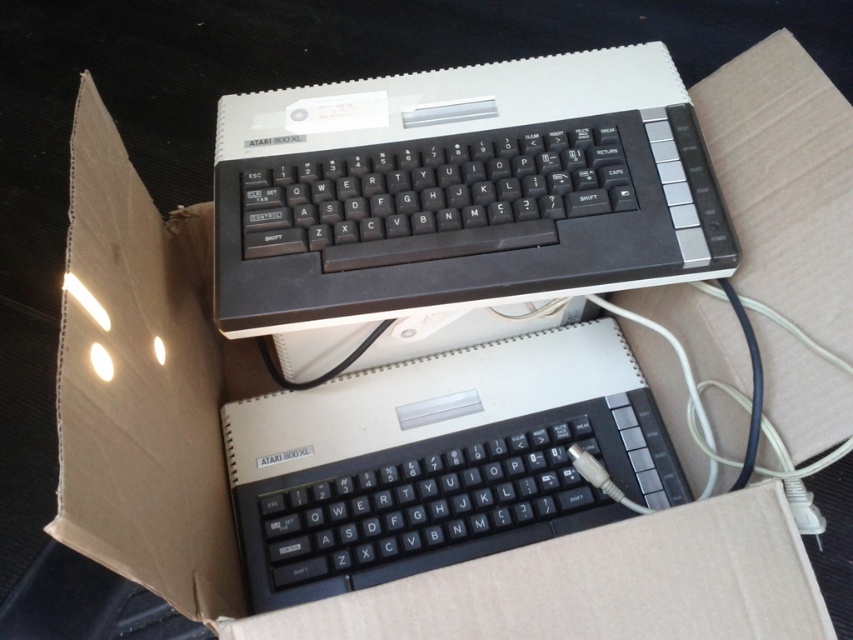
Question: Is black plastic keyboard at upper center further to the viewer compared to black plastic keyboard at center?

Choices:
 (A) yes
 (B) no

Answer: (B)

Question: Which object is farther from the camera taking this photo?

Choices:
 (A) black plastic keyboard at upper center
 (B) black plastic keyboard at center

Answer: (B)

Question: Among these objects, which one is nearest to the camera?

Choices:
 (A) black plastic keyboard at center
 (B) black plastic keyboard at upper center

Answer: (B)

Question: Does black plastic keyboard at upper center lie behind black plastic keyboard at center?

Choices:
 (A) yes
 (B) no

Answer: (B)

Question: Is black plastic keyboard at upper center below black plastic keyboard at center?

Choices:
 (A) yes
 (B) no

Answer: (B)

Question: Which of the following is the closest to the observer?

Choices:
 (A) (445, 384)
 (B) (260, 236)

Answer: (B)